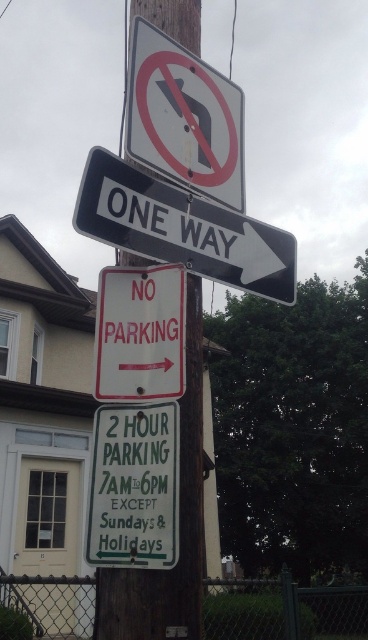
Question: Is black plastic one way sign at upper right closer to the viewer compared to red matte/no parking sign at center?

Choices:
 (A) no
 (B) yes

Answer: (A)

Question: Which point is closer to the camera taking this photo?

Choices:
 (A) (171, 445)
 (B) (218, 252)
 (C) (172, 323)

Answer: (A)

Question: Is green paper sign at lower center to the right of red matte/no parking sign at center from the viewer's perspective?

Choices:
 (A) no
 (B) yes

Answer: (A)

Question: Based on their relative distances, which object is nearer to the red matte/no parking sign at center?

Choices:
 (A) green paper sign at lower center
 (B) white plastic sign at upper center

Answer: (A)

Question: Observing the image, what is the correct spatial positioning of black plastic one way sign at upper right in reference to green paper sign at lower center?

Choices:
 (A) left
 (B) right

Answer: (B)

Question: Among these points, which one is nearest to the camera?

Choices:
 (A) (227, 253)
 (B) (179, 51)
 (C) (105, 342)
 (D) (161, 436)

Answer: (D)